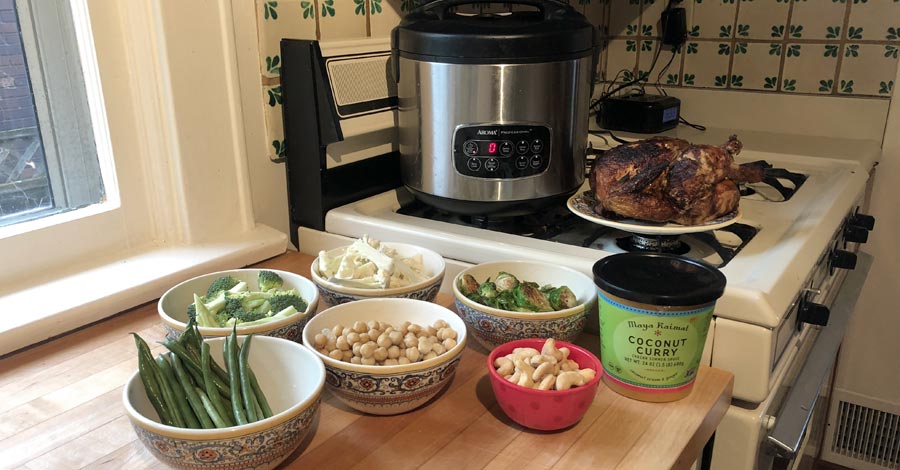
The height and width of the screenshot is (470, 900). Find the location of `window sill`. window sill is located at coordinates (85, 209).